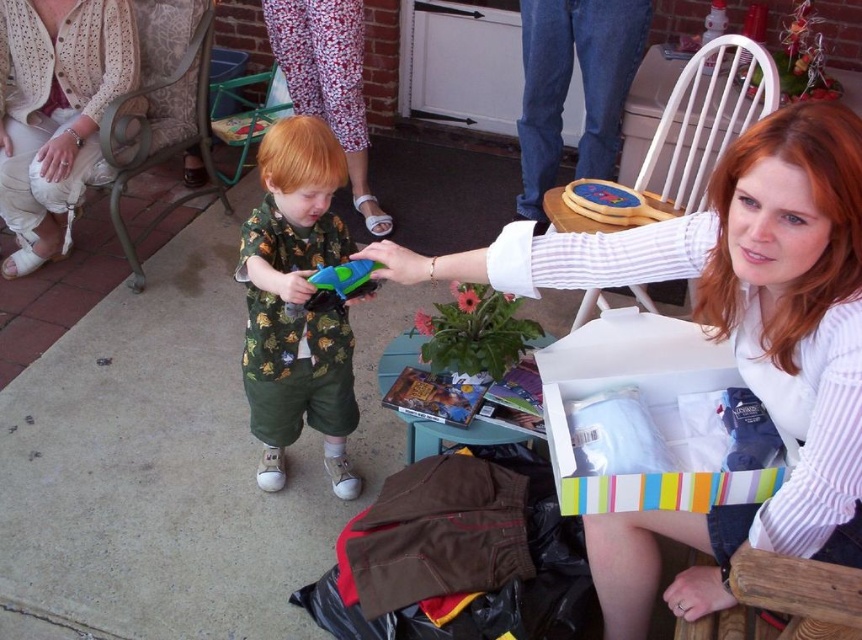
Looking at this image, you are organizing a small gathering in the backyard and need to decide whether to place a decorative pillow on the metallic fabric chair at upper left. Considering the white crochet cardigan at upper left is already on the chair, will there be enough space for the pillow?

The white crochet cardigan at upper left has a smaller size compared to metallic fabric chair at upper left. Since the cardigan is smaller, there should be enough space left on the metallic fabric chair at upper left to place the decorative pillow.

You are planning to place a small potted plant between the metallic fabric chair at upper left and the brick wall in the background. Based on the scene description, can you determine if there is enough space for the plant between them?

The metallic fabric chair at upper left is located at point (161, 109), which is close to the brick wall in the background. However, without specific distance information between the chair and the wall, it is unclear if there is enough space for the potted plant. The scene description does not provide exact measurements or spatial relationships between these objects.

You are standing in the backyard and need to sit down. There is a metallic fabric chair at upper left. Can you reach it within 3 steps if each step covers about 2.5 feet?

The metallic fabric chair at upper left is 8.10 feet away. Since each step covers 2.5 feet, 3 steps would cover 7.5 feet. Therefore, you cannot reach it within 3 steps as the distance is slightly more than that.